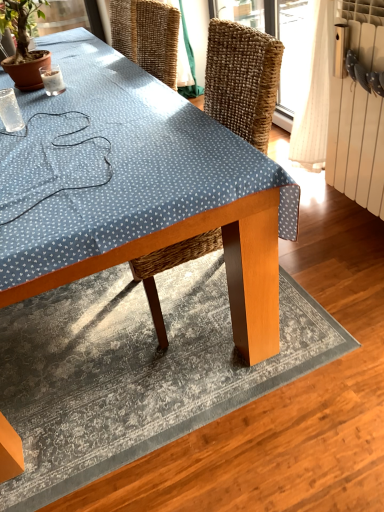
Question: Is wooden table at center behind green leafy plant at upper left?

Choices:
 (A) no
 (B) yes

Answer: (A)

Question: Does wooden table at center appear on the left side of green leafy plant at upper left?

Choices:
 (A) no
 (B) yes

Answer: (A)

Question: Considering the relative positions of wooden table at center and green leafy plant at upper left in the image provided, is wooden table at center to the right of green leafy plant at upper left from the viewer's perspective?

Choices:
 (A) yes
 (B) no

Answer: (A)

Question: Is wooden table at center oriented away from green leafy plant at upper left?

Choices:
 (A) no
 (B) yes

Answer: (A)

Question: Is the surface of wooden table at center in direct contact with green leafy plant at upper left?

Choices:
 (A) yes
 (B) no

Answer: (B)

Question: From the image's perspective, is clear glass coffee cup at upper left, the first coffee cup in the back-to-front sequence, positioned above or below green leafy plant at upper left?

Choices:
 (A) above
 (B) below

Answer: (B)

Question: Considering the positions of clear glass coffee cup at upper left, the first coffee cup in the back-to-front sequence, and green leafy plant at upper left in the image, is clear glass coffee cup at upper left, the first coffee cup in the back-to-front sequence, wider or thinner than green leafy plant at upper left?

Choices:
 (A) thin
 (B) wide

Answer: (A)

Question: Is clear glass coffee cup at upper left, which appears as the 1th coffee cup when viewed from the top, in front of or behind green leafy plant at upper left in the image?

Choices:
 (A) front
 (B) behind

Answer: (B)

Question: In terms of height, does clear glass coffee cup at upper left, which appears as the 1th coffee cup when viewed from the top, look taller or shorter compared to green leafy plant at upper left?

Choices:
 (A) short
 (B) tall

Answer: (A)

Question: From a real-world perspective, is clear glass coffee cup at upper left, which appears as the 1th coffee cup when viewed from the top, above or below white radiator at right?

Choices:
 (A) above
 (B) below

Answer: (A)

Question: Choose the correct answer: Is clear glass coffee cup at upper left, the 2th coffee cup in the front-to-back sequence, inside white radiator at right or outside it?

Choices:
 (A) inside
 (B) outside

Answer: (B)

Question: Considering the positions of clear glass coffee cup at upper left, which appears as the 1th coffee cup when viewed from the top, and white radiator at right in the image, is clear glass coffee cup at upper left, which appears as the 1th coffee cup when viewed from the top, bigger or smaller than white radiator at right?

Choices:
 (A) big
 (B) small

Answer: (B)

Question: Is point (44, 76) positioned closer to the camera than point (347, 108)?

Choices:
 (A) closer
 (B) farther

Answer: (A)

Question: In the image, is green leafy plant at upper left positioned in front of or behind clear glass coffee cup at upper left, the first coffee cup in the back-to-front sequence?

Choices:
 (A) front
 (B) behind

Answer: (A)

Question: Is green leafy plant at upper left inside the boundaries of clear glass coffee cup at upper left, which is counted as the second coffee cup, starting from the bottom, or outside?

Choices:
 (A) outside
 (B) inside

Answer: (A)